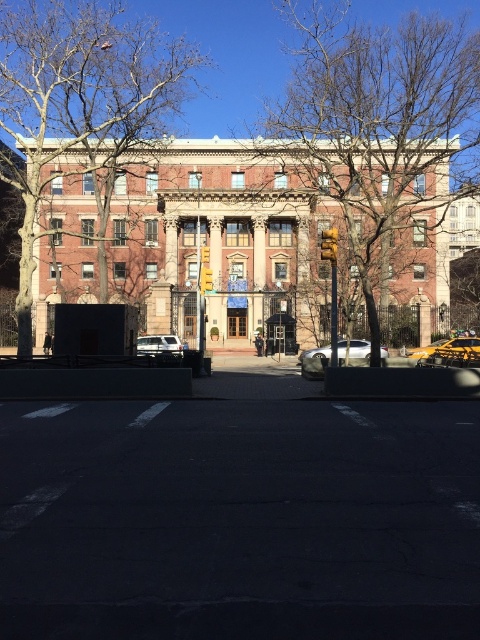
Question: Which object is farther from the camera taking this photo?

Choices:
 (A) white matte car at center
 (B) brown leafless tree at center
 (C) white matte van at center
 (D) bare branches at left

Answer: (B)

Question: Which object is positioned farthest from the bare branches at left?

Choices:
 (A) yellow matte taxi at right
 (B) white matte van at center
 (C) white matte car at center

Answer: (A)

Question: Considering the relative positions of bare branches at left and white matte van at center in the image provided, where is bare branches at left located with respect to white matte van at center?

Choices:
 (A) left
 (B) right

Answer: (A)

Question: Can you confirm if brown leafless tree at center is positioned below white matte van at center?

Choices:
 (A) yes
 (B) no

Answer: (B)

Question: Among these objects, which one is nearest to the camera?

Choices:
 (A) brown leafless tree at center
 (B) white matte van at center
 (C) yellow matte taxi at right
 (D) white matte car at center

Answer: (B)

Question: Where is yellow matte taxi at right located in relation to white matte van at center in the image?

Choices:
 (A) right
 (B) left

Answer: (A)